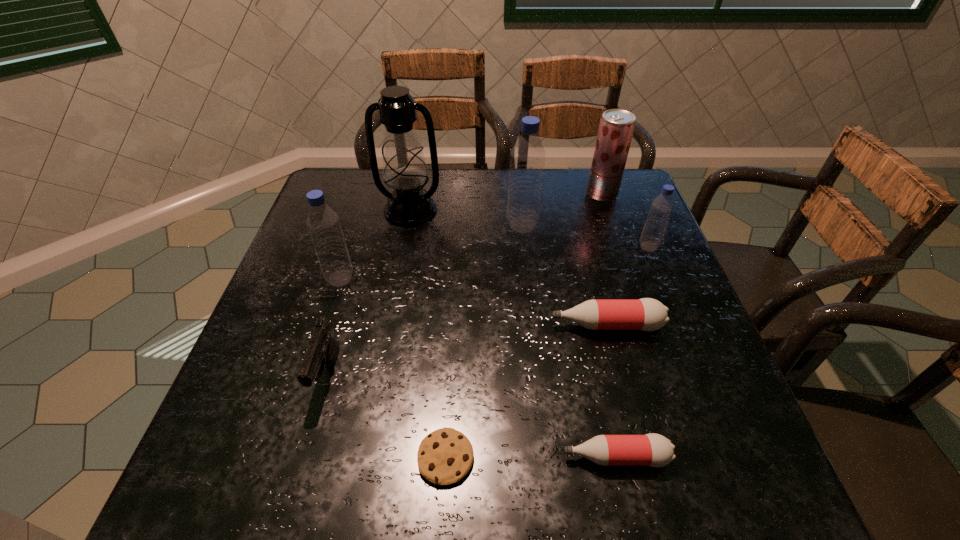
Where is `vacant space at the far edge`? vacant space at the far edge is located at coordinates (444, 187).

The image size is (960, 540). In the image, there is a desktop. Find the location of `vacant space at the right edge`. vacant space at the right edge is located at coordinates (726, 441).

Locate an element on the screen. This screenshot has height=540, width=960. vacant space at the far left corner is located at coordinates (336, 201).

Where is `free location at the far right corner of the desktop`? This screenshot has height=540, width=960. free location at the far right corner of the desktop is located at coordinates (602, 202).

Identify the location of vacant space that's between the biggest blue bottle and the oil lamp. This screenshot has height=540, width=960. (467, 218).

Find the location of `vacant area between the farther pink bottle and the second blue bottle from right to left`. vacant area between the farther pink bottle and the second blue bottle from right to left is located at coordinates (564, 275).

You are a GUI agent. You are given a task and a screenshot of the screen. Output one action in this format:
    pyautogui.click(x=<x>, y=<y>)
    Task: Click on the unoccupied area between the oil lamp and the shortest bottle
    
    Given the screenshot: What is the action you would take?
    pyautogui.click(x=513, y=334)

You are a GUI agent. You are given a task and a screenshot of the screen. Output one action in this format:
    pyautogui.click(x=<x>, y=<y>)
    Task: Click on the empty space that is in between the fifth nearest object and the biggest blue bottle
    
    Given the screenshot: What is the action you would take?
    pyautogui.click(x=431, y=252)

Image resolution: width=960 pixels, height=540 pixels. What are the coordinates of `blank region between the rightmost blue bottle and the brown cookie` in the screenshot? It's located at (547, 352).

Find the location of `free space between the tallest bottle and the second smallest blue bottle`. free space between the tallest bottle and the second smallest blue bottle is located at coordinates (431, 252).